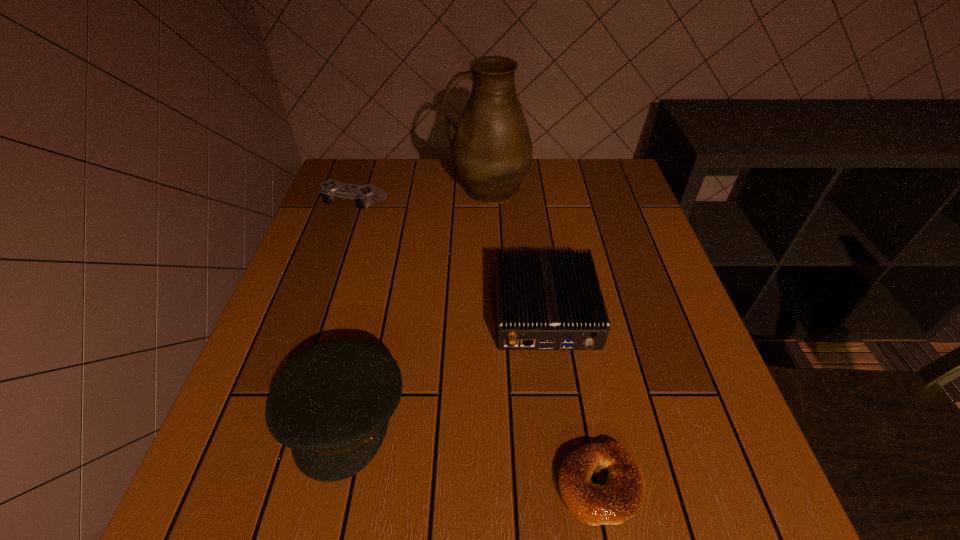
Where is `vacant area between the beret and the control`? vacant area between the beret and the control is located at coordinates (350, 308).

Image resolution: width=960 pixels, height=540 pixels. I want to click on free point between the pitcher and the router, so click(x=516, y=249).

At what (x,y) coordinates should I click in order to perform the action: click on free space between the bagel and the beret. Please return your answer as a coordinate pair (x, y). Looking at the image, I should click on (471, 449).

I want to click on vacant area that lies between the beret and the control, so coord(350,308).

Where is `vacant point located between the tallest object and the fourth tallest object`? The image size is (960, 540). vacant point located between the tallest object and the fourth tallest object is located at coordinates (421, 195).

This screenshot has height=540, width=960. Identify the location of vacant point located between the control and the bagel. (478, 343).

Identify the location of object that ranks as the closest to the shortest object. The height and width of the screenshot is (540, 960). (545, 300).

Identify the location of the fourth closest object relative to the second tallest object. (491, 147).

This screenshot has width=960, height=540. Identify the location of vacant space that satisfies the following two spatial constraints: 1. on the front-facing side of the shortest object; 2. on the right side of the beret. (327, 484).

Where is `vacant point that satisfies the following two spatial constraints: 1. on the back panel of the shortest object; 2. on the left side of the third tallest object`? The image size is (960, 540). vacant point that satisfies the following two spatial constraints: 1. on the back panel of the shortest object; 2. on the left side of the third tallest object is located at coordinates (568, 484).